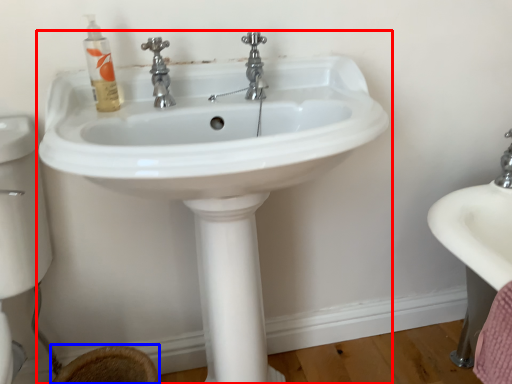
Question: Which object is closer to the camera taking this photo, sink (highlighted by a red box) or toilet bowl (highlighted by a blue box)?

Choices:
 (A) sink
 (B) toilet bowl

Answer: (A)